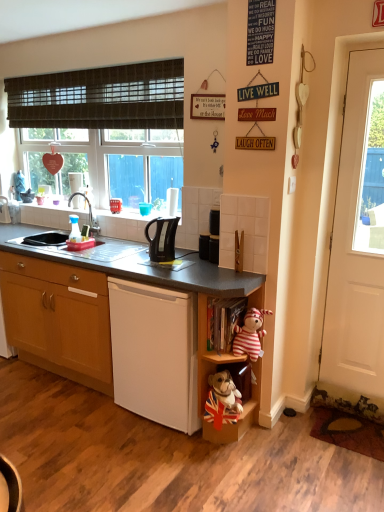
You are a GUI agent. You are given a task and a screenshot of the screen. Output one action in this format:
    pyautogui.click(x=<x>, y=<y>)
    Task: Click on the free space in front of white matte dishwasher at center
    
    Given the screenshot: What is the action you would take?
    pyautogui.click(x=167, y=454)